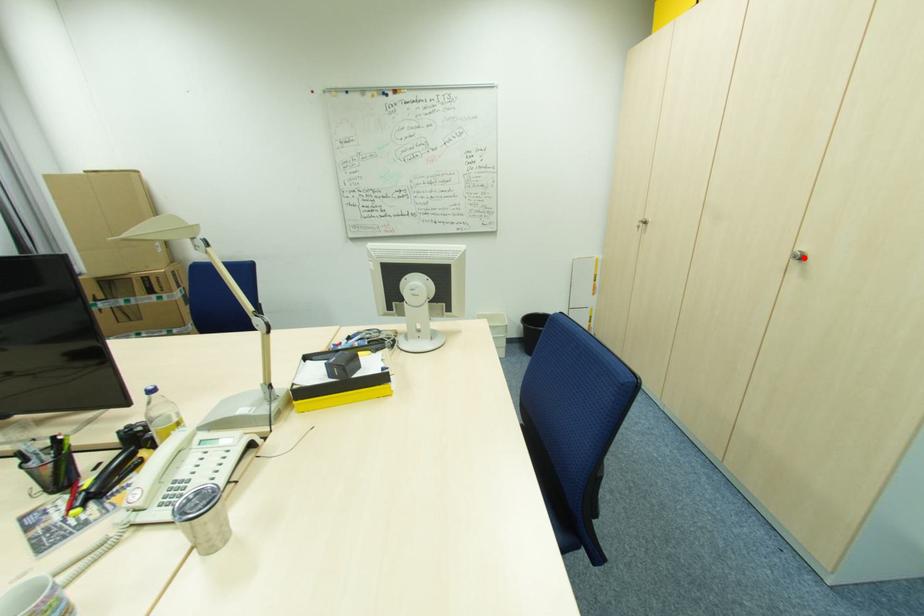
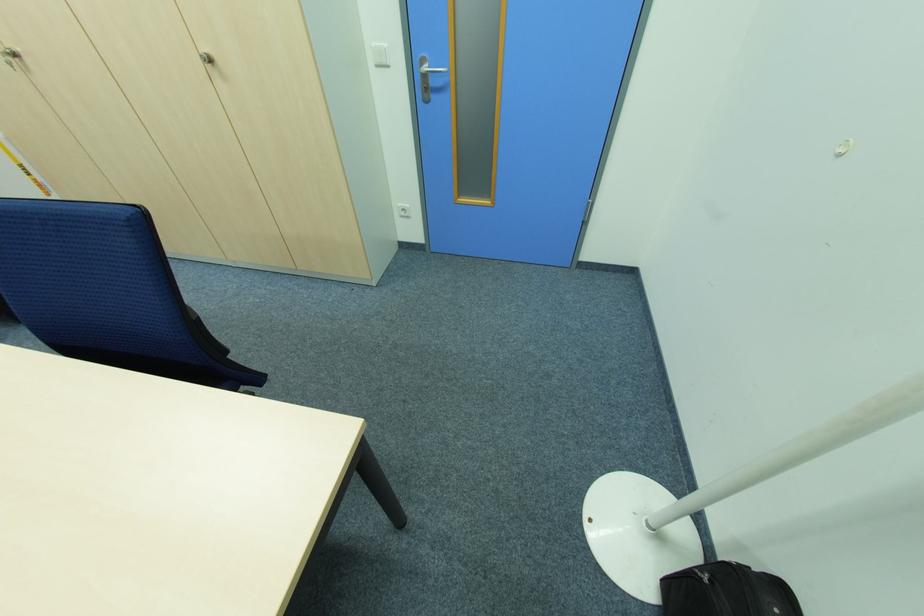
In the second image, find the point that corresponds to the highlighted location in the first image.

(213, 62)